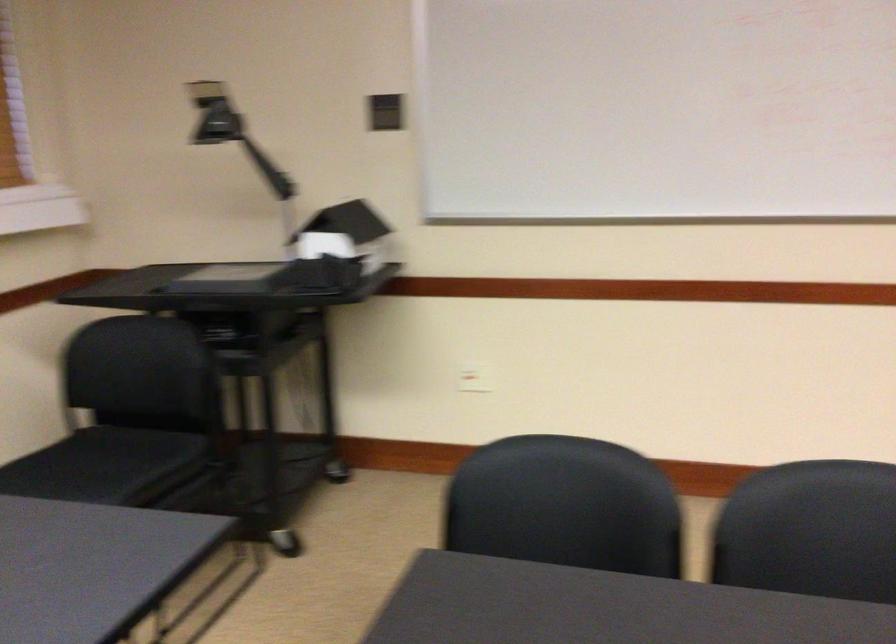
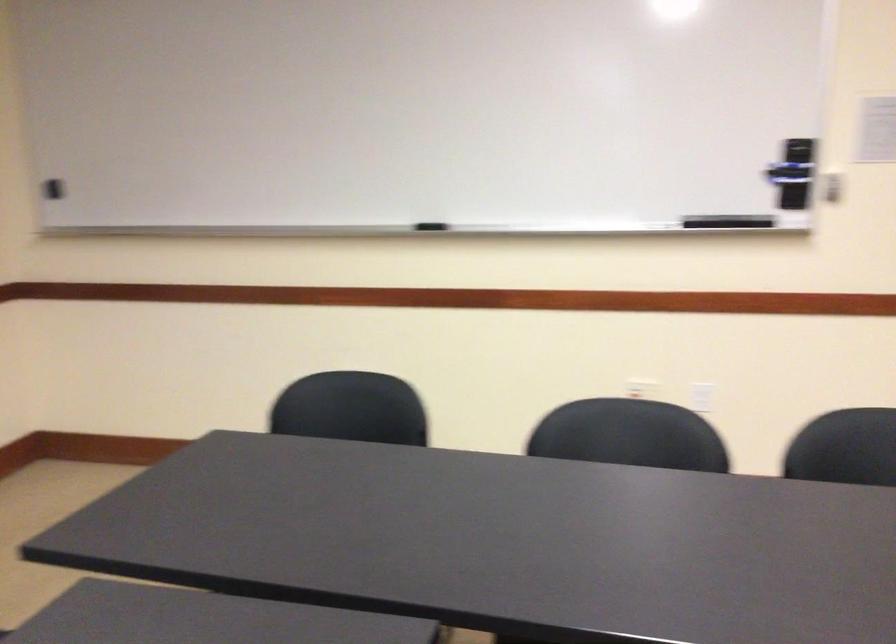
Question: The camera is either moving clockwise (left) or counter-clockwise (right) around the object. The first image is from the beginning of the video and the second image is from the end. Is the camera moving left or right when shooting the video?

Choices:
 (A) Left
 (B) Right

Answer: (A)